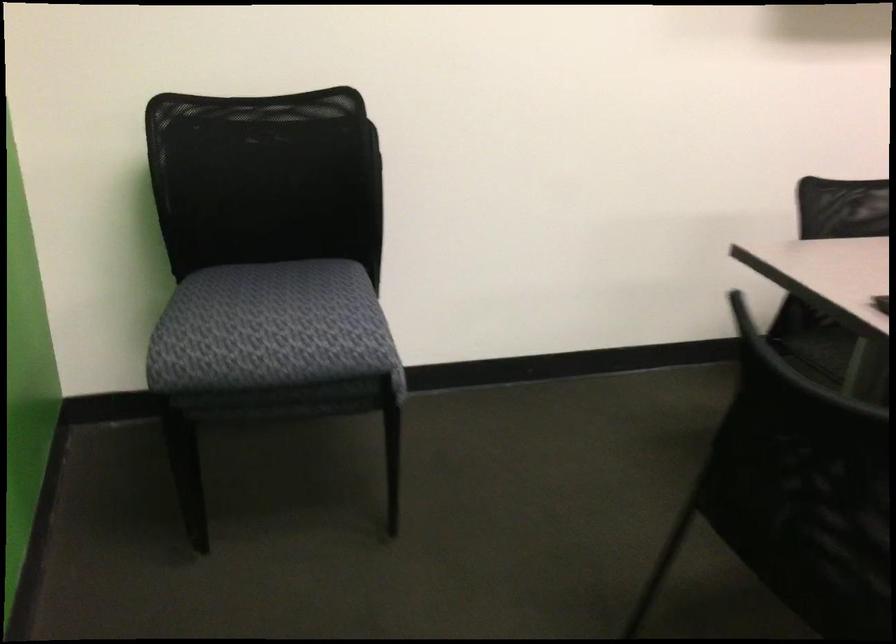
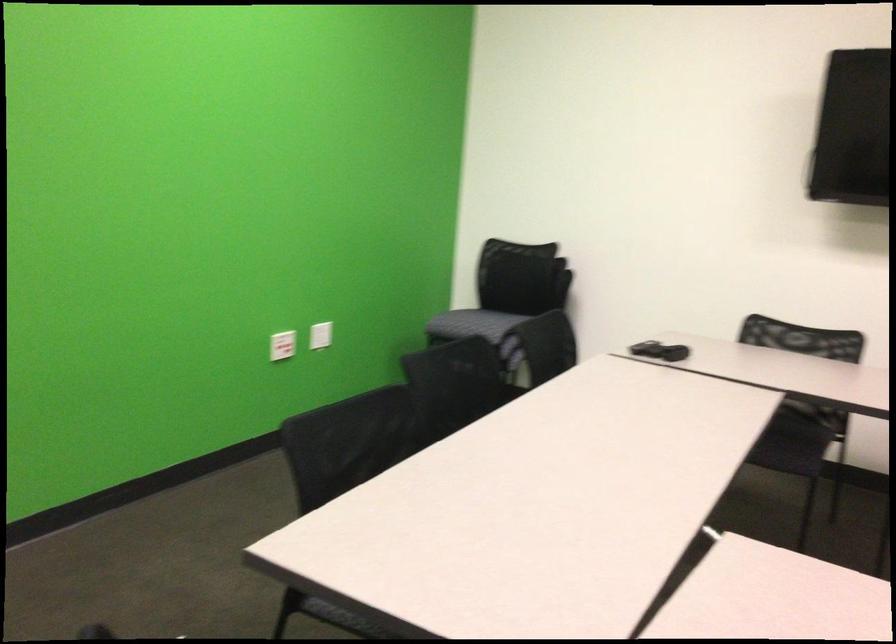
In the second image, find the point that corresponds to the point at 271,328 in the first image.

(457, 299)